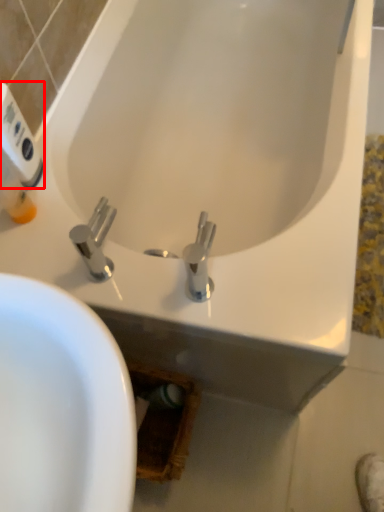
Question: Considering the relative positions of hand dryer (annotated by the red box) and tap in the image provided, where is hand dryer (annotated by the red box) located with respect to the staircase?

Choices:
 (A) left
 (B) right

Answer: (A)